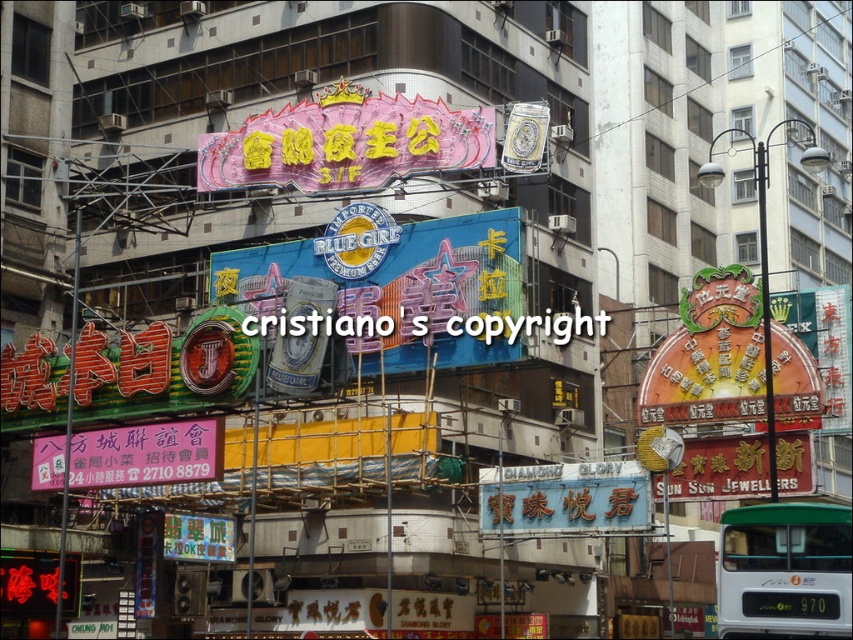
You are a photographer wanting to capture both the pink glossy neon sign at upper center and the black plastic text at center in a single shot. Based on their positions, which object should appear closer to the camera in the photo?

The pink glossy neon sign at upper center will appear closer to the camera because the black plastic text at center is positioned behind it.

You are a pedestrian standing in front of the green matte bus at lower right and the black plastic text at center. Which object would appear closer to you?

The green matte bus at lower right appears closer because it has a larger size compared to the black plastic text at center, indicating it is nearer.

You are a pedestrian standing at the center of the image. There is a point marked at coordinates point (x=784, y=570). What object is located at that point?

The point (x=784, y=570) marks the green matte bus at lower right.